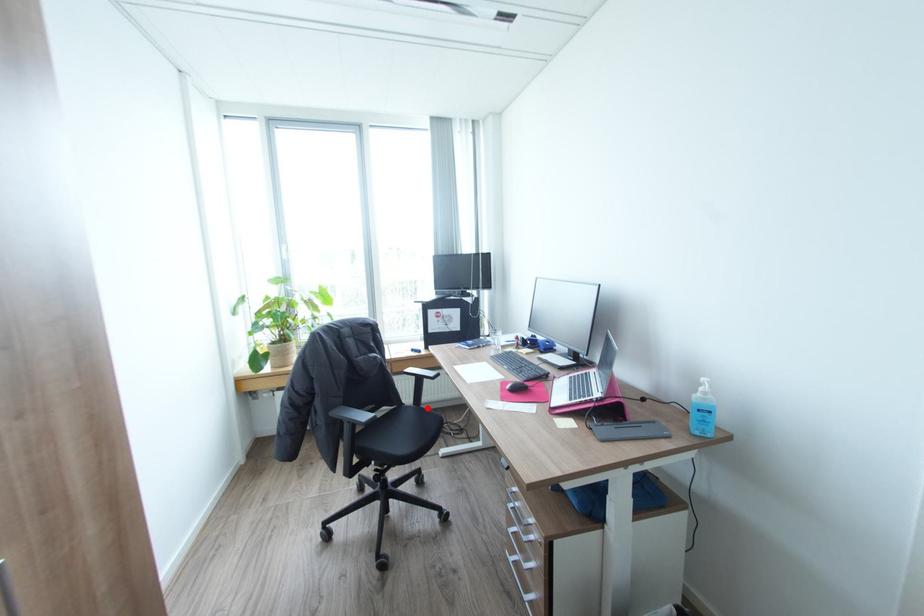
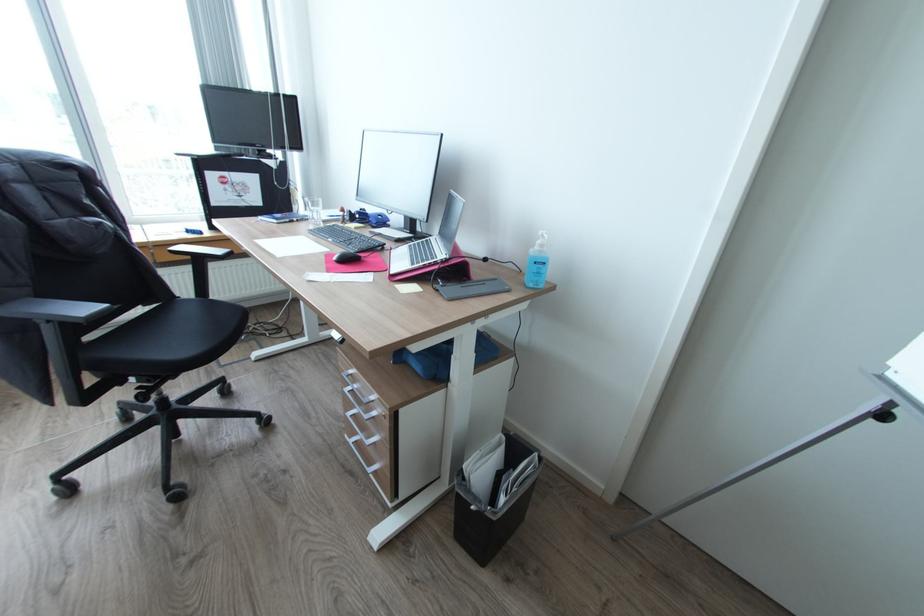
Where in the second image is the point corresponding to the highlighted location from the first image?

(217, 300)